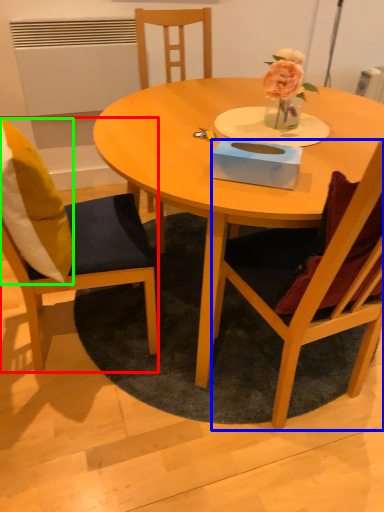
Question: Considering the real-world distances, which object is closest to chair (highlighted by a red box)? chair (highlighted by a blue box) or pillow (highlighted by a green box).

Choices:
 (A) chair
 (B) pillow

Answer: (B)